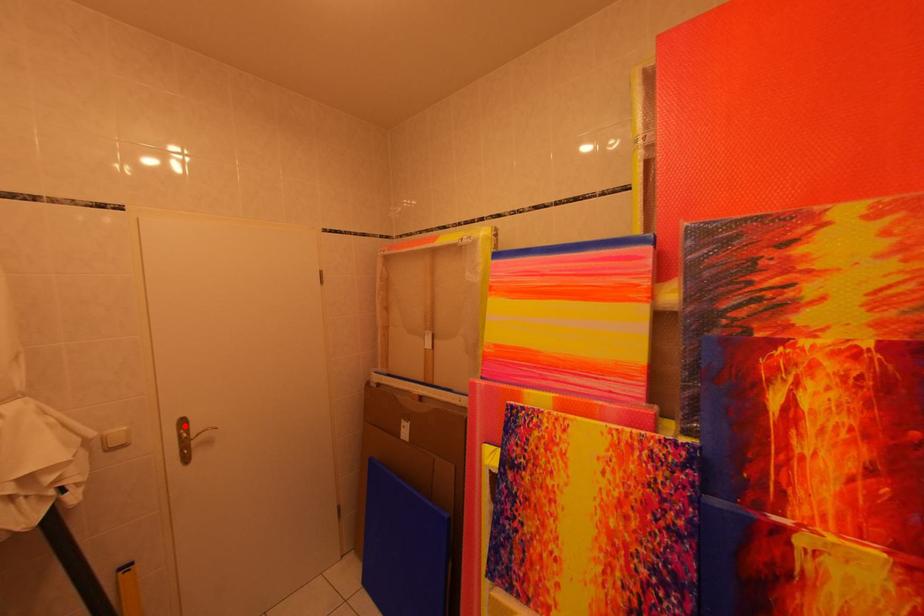
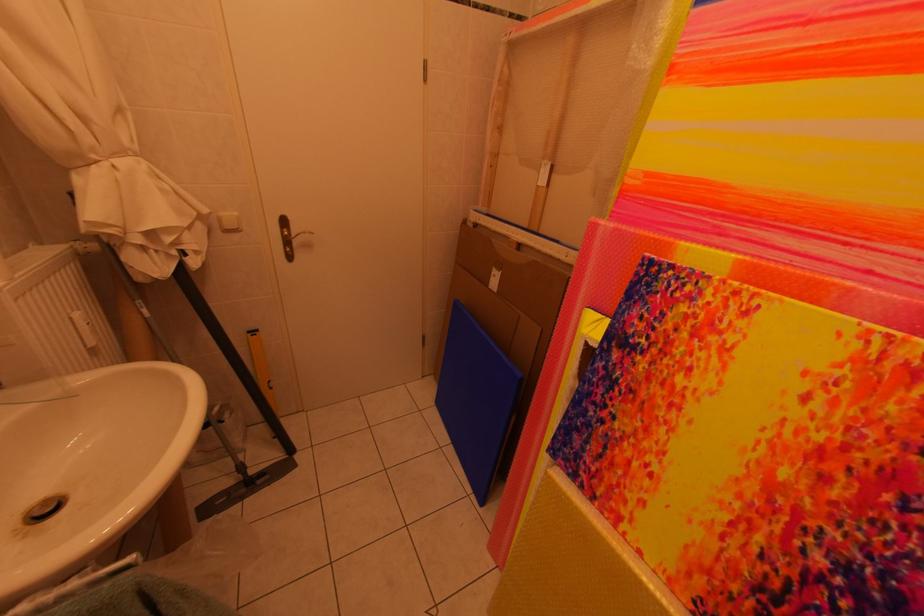
Where in the second image is the point corresponding to the highlighted location from the first image?

(286, 223)